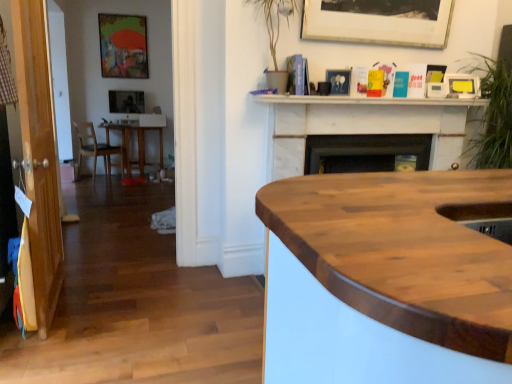
The height and width of the screenshot is (384, 512). In order to click on white marble fireplace at upper center in this screenshot , I will do `click(365, 101)`.

The width and height of the screenshot is (512, 384). Identify the location of matte wooden picture frame at upper left, the fourth picture frame ordered from the bottom. (123, 46).

Where is `yellow matte picture frame at upper right, the 1th picture frame from the right`? yellow matte picture frame at upper right, the 1th picture frame from the right is located at coordinates (462, 85).

What do you see at coordinates (462, 85) in the screenshot?
I see `yellow matte picture frame at upper right, the 3th picture frame when ordered from top to bottom` at bounding box center [462, 85].

What do you see at coordinates (339, 81) in the screenshot? The image size is (512, 384). I see `matte black picture frame at upper center, positioned as the first picture frame in bottom-to-top order` at bounding box center [339, 81].

You are a GUI agent. You are given a task and a screenshot of the screen. Output one action in this format:
    pyautogui.click(x=<x>, y=<y>)
    Task: Click on the wooden table at left
    The width and height of the screenshot is (512, 384).
    Given the screenshot: What is the action you would take?
    tap(138, 146)

Considering the sizes of matte black picture frame at upper left, marked as the second picture frame in a left-to-right arrangement, and matte black picture frame at upper center, the first picture frame when ordered from front to back, in the image, is matte black picture frame at upper left, marked as the second picture frame in a left-to-right arrangement, bigger or smaller than matte black picture frame at upper center, the first picture frame when ordered from front to back,?

In the image, matte black picture frame at upper left, marked as the second picture frame in a left-to-right arrangement, appears to be larger than matte black picture frame at upper center, the first picture frame when ordered from front to back.

Do you think matte black picture frame at upper left, which is the fourth picture frame in front-to-back order, is within matte black picture frame at upper center, the 3th picture frame positioned from the left, or outside of it?

matte black picture frame at upper left, which is the fourth picture frame in front-to-back order, is located beyond the bounds of matte black picture frame at upper center, the 3th picture frame positioned from the left.

Which object is further away from the camera taking this photo, matte black picture frame at upper left, positioned as the third picture frame in right-to-left order, or matte black picture frame at upper center, which is counted as the fourth picture frame, starting from the back?

matte black picture frame at upper left, positioned as the third picture frame in right-to-left order, is further away from the camera.

From the picture: Measure the distance between matte black picture frame at upper left, which is the fourth picture frame in front-to-back order, and matte black picture frame at upper center, positioned as the first picture frame in bottom-to-top order.

A distance of 12.69 feet exists between matte black picture frame at upper left, which is the fourth picture frame in front-to-back order, and matte black picture frame at upper center, positioned as the first picture frame in bottom-to-top order.

At what (x,y) coordinates should I click in order to perform the action: click on the 1st picture frame positioned above the black matte fireplace at center (from the image's perspective). Please return your answer as a coordinate pair (x, y). Looking at the image, I should click on (339, 81).

Based on the photo, is matte black picture frame at upper center, marked as the 2th picture frame in a right-to-left arrangement, with black matte fireplace at center?

They are not placed beside each other.

From a real-world perspective, is matte black picture frame at upper center, which is counted as the fourth picture frame, starting from the back, below black matte fireplace at center?

Incorrect, from a real-world perspective, matte black picture frame at upper center, which is counted as the fourth picture frame, starting from the back, is higher than black matte fireplace at center.

Is point (338, 86) closer or farther from the camera than point (398, 157)?

Point (338, 86) is positioned closer to the camera compared to point (398, 157).

Looking at this image, is wooden chair at left oriented towards white marble fireplace at upper center?

No.

Is wooden chair at left wider than white marble fireplace at upper center?

Yes.

Does point (101, 151) come closer to viewer compared to point (368, 98)?

No, (101, 151) is behind (368, 98).

Where is `the 4th picture frame behind the transparent wood door at left`? This screenshot has height=384, width=512. the 4th picture frame behind the transparent wood door at left is located at coordinates (126, 101).

How distant is matte black picture frame at upper left, positioned as the third picture frame in right-to-left order, from transparent wood door at left?

A distance of 3.74 meters exists between matte black picture frame at upper left, positioned as the third picture frame in right-to-left order, and transparent wood door at left.

Which of these two, matte black picture frame at upper left, which is counted as the second picture frame, starting from the top, or transparent wood door at left, is smaller?

Smaller between the two is matte black picture frame at upper left, which is counted as the second picture frame, starting from the top.

Find the location of a particular element. This screenshot has width=512, height=384. glass door above the wooden table at left (from a real-world perspective) is located at coordinates (39, 154).

Is transparent wood door at left surrounded by wooden table at left?

No, wooden table at left does not contain transparent wood door at left.

From the image's perspective, is wooden table at left above transparent wood door at left?

Yes, from the image's perspective, wooden table at left is over transparent wood door at left.

Between wooden table at left and transparent wood door at left, which one has larger width?

wooden table at left.

From the image's perspective, is black matte fireplace at center positioned above or below wooden table at left?

black matte fireplace at center is situated lower than wooden table at left in the image.

Identify the location of fireplace located on the right of wooden table at left. This screenshot has height=384, width=512. [366, 153].

Which is closer to the camera, (403, 146) or (161, 131)?

Point (403, 146) is closer to the camera than point (161, 131).

Considering the relative positions of black matte fireplace at center and wooden table at left in the image provided, is black matte fireplace at center to the right of wooden table at left from the viewer's perspective?

Yes.

Which is behind, point (377, 102) or point (458, 250)?

The point (377, 102) is behind.

From the image's perspective, between white marble fireplace at upper center and wooden at center, which one is located above?

From the image's view, white marble fireplace at upper center is above.

Is white marble fireplace at upper center outside of wooden at center?

Yes, white marble fireplace at upper center is located beyond the bounds of wooden at center.

Is white marble fireplace at upper center to the right of wooden at center from the viewer's perspective?

Correct, you'll find white marble fireplace at upper center to the right of wooden at center.

Locate an element on the screen. picture frame located underneath the matte black picture frame at upper center, the 3th picture frame positioned from the left (from a real-world perspective) is located at coordinates (126, 101).

At what (x,y) coordinates should I click in order to perform the action: click on fireplace below the matte black picture frame at upper center, which is the 4th picture frame in top-to-bottom order (from the image's perspective). Please return your answer as a coordinate pair (x, y). Looking at the image, I should click on (366, 153).

Looking at the image, which one is located closer to wooden chair at left, green leafy plant at upper right or matte black picture frame at upper center, the 3th picture frame positioned from the left?

matte black picture frame at upper center, the 3th picture frame positioned from the left.

From the picture: Looking at the image, which one is located closer to matte black picture frame at upper left, which is counted as the second picture frame, starting from the top, white marble fireplace at upper center or wooden chair at left?

wooden chair at left lies closer to matte black picture frame at upper left, which is counted as the second picture frame, starting from the top, than the other object.

Looking at the image, which one is located further to transparent wood door at left, wooden at center or yellow matte picture frame at upper right, which appears as the 2th picture frame when ordered from the bottom?

Among the two, yellow matte picture frame at upper right, which appears as the 2th picture frame when ordered from the bottom, is located further to transparent wood door at left.

Considering their positions, is transparent wood door at left positioned closer to wooden at center than matte black picture frame at upper left, which is counted as the second picture frame, starting from the top?

Among the two, transparent wood door at left is located nearer to wooden at center.

Which object lies further to the anchor point green leafy plant at upper right, matte black picture frame at upper left, which is counted as the second picture frame, starting from the top, or yellow matte picture frame at upper right, the 1th picture frame from the right?

Among the two, matte black picture frame at upper left, which is counted as the second picture frame, starting from the top, is located further to green leafy plant at upper right.

From the image, which object appears to be farther from matte black picture frame at upper left, the first picture frame in the back-to-front sequence, green leafy plant at upper right or wooden chair at left?

green leafy plant at upper right is positioned further to the anchor matte black picture frame at upper left, the first picture frame in the back-to-front sequence.

When comparing their distances from wooden at center, does transparent wood door at left or black matte fireplace at center seem further?

black matte fireplace at center lies further to wooden at center than the other object.

Which object lies nearer to the anchor point transparent wood door at left, green leafy plant at upper right or wooden chair at left?

green leafy plant at upper right is positioned closer to the anchor transparent wood door at left.

The image size is (512, 384). Identify the location of fireplace between wooden table at left and green leafy plant at upper right. (366, 153).

The height and width of the screenshot is (384, 512). Identify the location of glass door positioned between wooden at center and wooden chair at left from near to far. (39, 154).

The width and height of the screenshot is (512, 384). I want to click on picture frame between black matte fireplace at center and green leafy plant at upper right, so click(x=462, y=85).

Find the location of `fireplace positioned between wooden at center and wooden chair at left from near to far`. fireplace positioned between wooden at center and wooden chair at left from near to far is located at coordinates (366, 153).